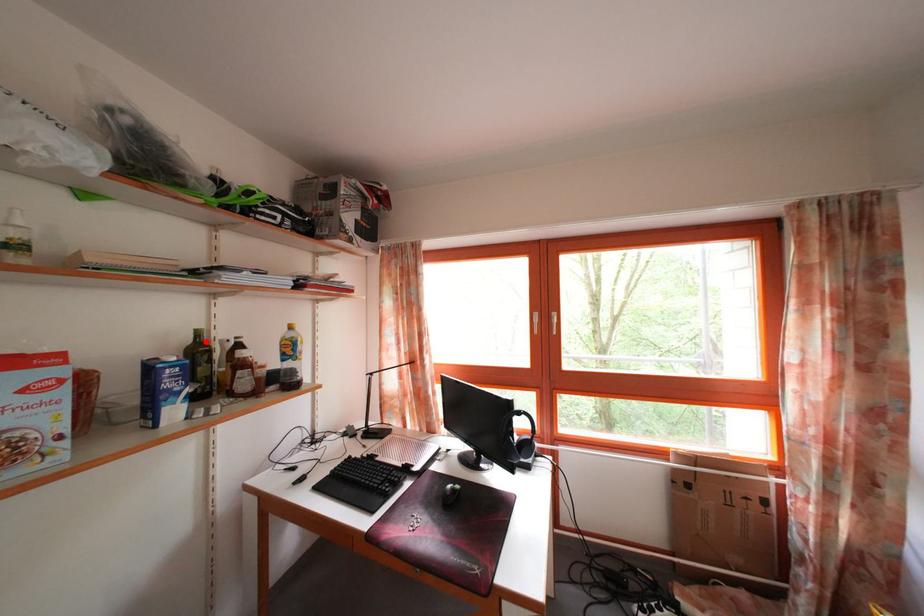
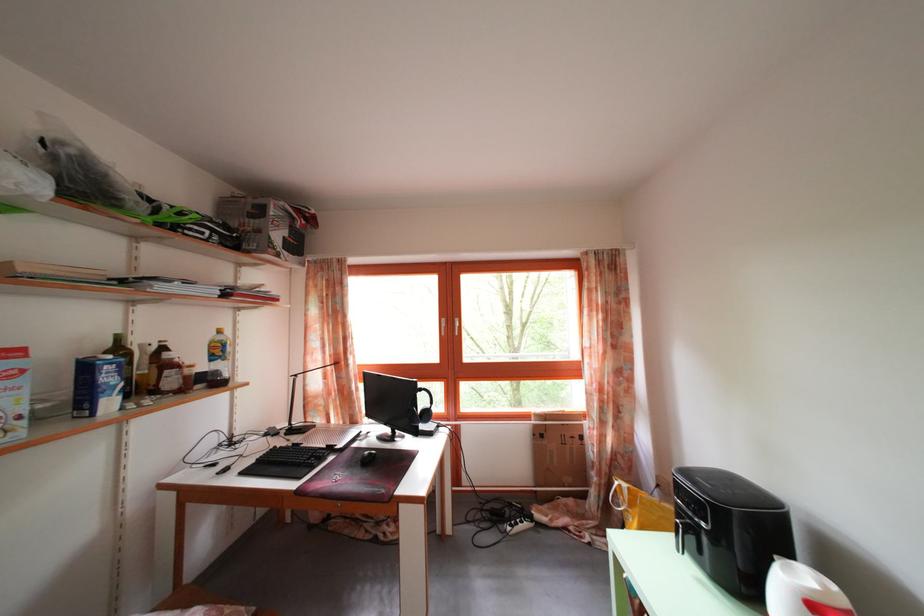
Question: I am providing you with two images of the same scene from different viewpoints. A red point is marked on the first image. Is the red point's position out of view in image 2?

Choices:
 (A) Yes
 (B) No

Answer: (B)